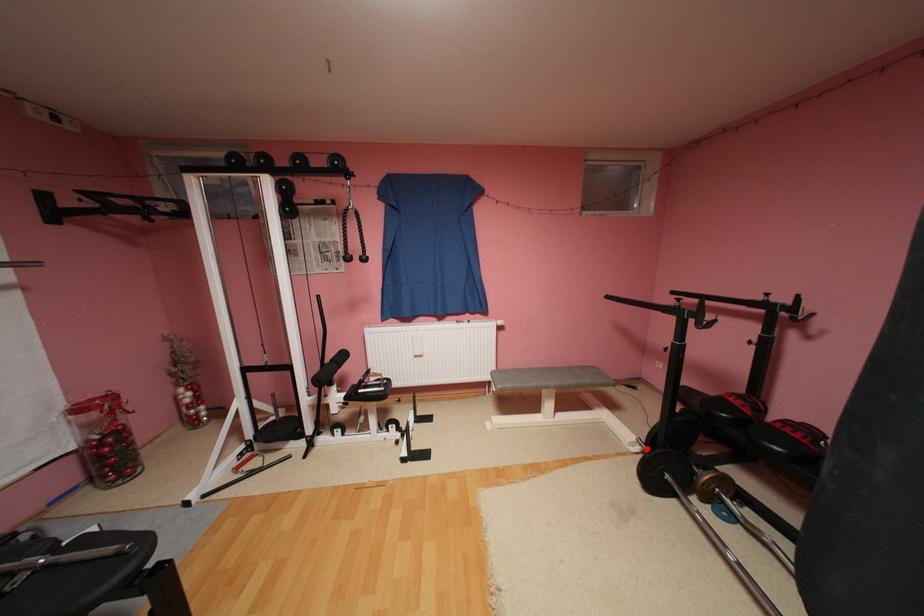
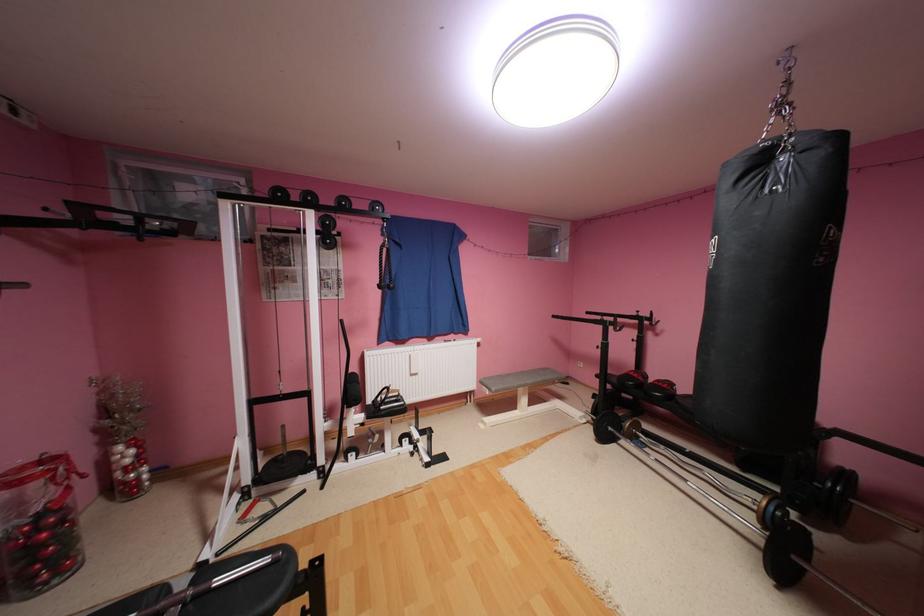
Question: I am providing you with two images of the same scene from different viewpoints. A red point is shown in image1. For the corresponding object point in image2, is it positioned nearer or farther from the camera?

Choices:
 (A) Nearer
 (B) Farther

Answer: (B)